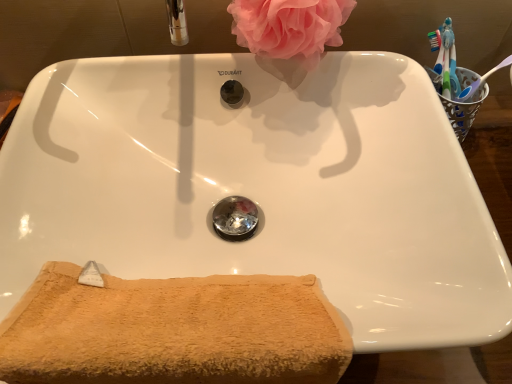
Question: Should I look upward or downward to see pink fluffy sponge at upper center?

Choices:
 (A) down
 (B) up

Answer: (B)

Question: Is the depth of pink fluffy sponge at upper center greater than that of beige terry cloth towel at lower left?

Choices:
 (A) yes
 (B) no

Answer: (A)

Question: Does pink fluffy sponge at upper center have a greater width compared to beige terry cloth towel at lower left?

Choices:
 (A) no
 (B) yes

Answer: (B)

Question: From a real-world perspective, is pink fluffy sponge at upper center positioned under beige terry cloth towel at lower left based on gravity?

Choices:
 (A) yes
 (B) no

Answer: (B)

Question: Does pink fluffy sponge at upper center have a greater height compared to beige terry cloth towel at lower left?

Choices:
 (A) no
 (B) yes

Answer: (A)

Question: Would you say pink fluffy sponge at upper center is a long distance from beige terry cloth towel at lower left?

Choices:
 (A) yes
 (B) no

Answer: (B)

Question: Is pink fluffy sponge at upper center thinner than beige terry cloth towel at lower left?

Choices:
 (A) yes
 (B) no

Answer: (B)

Question: Does beige terry cloth towel at lower left lie behind pink fluffy sponge at upper center?

Choices:
 (A) no
 (B) yes

Answer: (A)

Question: Considering the relative positions of beige terry cloth towel at lower left and pink fluffy sponge at upper center in the image provided, is beige terry cloth towel at lower left in front of pink fluffy sponge at upper center?

Choices:
 (A) yes
 (B) no

Answer: (A)

Question: Would you say beige terry cloth towel at lower left is outside pink fluffy sponge at upper center?

Choices:
 (A) yes
 (B) no

Answer: (A)

Question: Could you tell me if beige terry cloth towel at lower left is turned towards pink fluffy sponge at upper center?

Choices:
 (A) no
 (B) yes

Answer: (A)

Question: Is beige terry cloth towel at lower left surrounding pink fluffy sponge at upper center?

Choices:
 (A) yes
 (B) no

Answer: (B)

Question: Does beige terry cloth towel at lower left have a lesser width compared to pink fluffy sponge at upper center?

Choices:
 (A) yes
 (B) no

Answer: (A)

Question: Is point (264, 41) positioned closer to the camera than point (51, 350)?

Choices:
 (A) closer
 (B) farther

Answer: (B)